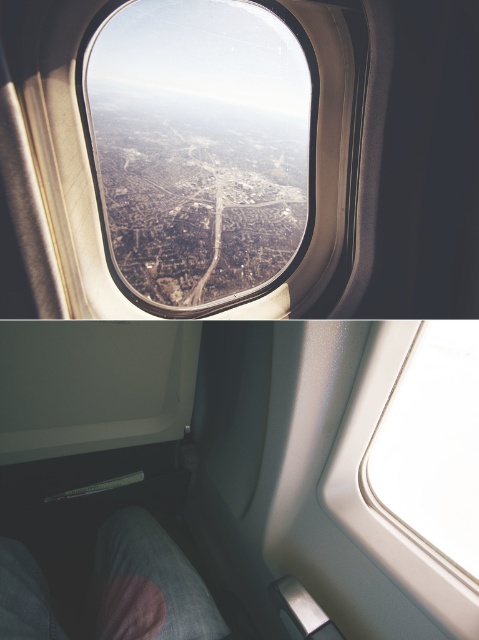
Question: Among these points, which one is nearest to the camera?

Choices:
 (A) (469, 362)
 (B) (287, 221)

Answer: (A)

Question: Which object is farther from the camera taking this photo?

Choices:
 (A) white glossy window at upper center
 (B) transparent glass airplane window at center

Answer: (B)

Question: Does transparent glass airplane window at center appear on the right side of white glossy window at upper center?

Choices:
 (A) yes
 (B) no

Answer: (B)

Question: Is transparent glass airplane window at center to the right of white glossy window at upper center from the viewer's perspective?

Choices:
 (A) yes
 (B) no

Answer: (B)

Question: Is transparent glass airplane window at center bigger than white glossy window at upper center?

Choices:
 (A) yes
 (B) no

Answer: (A)